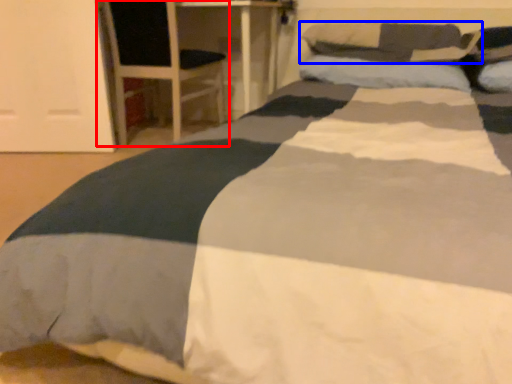
Question: Which point is further to the camera, armchair (highlighted by a red box) or pillow (highlighted by a blue box)?

Choices:
 (A) armchair
 (B) pillow

Answer: (A)